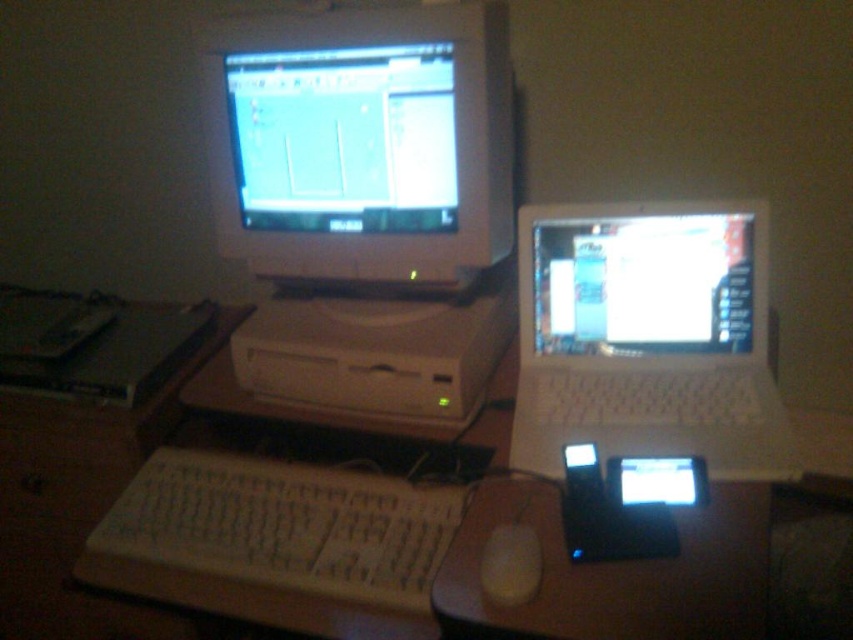
Is white glossy laptop at center thinner than white plastic mouse at center?

No.

Can you confirm if white glossy laptop at center is positioned below white plastic mouse at center?

No, white glossy laptop at center is not below white plastic mouse at center.

You are a GUI agent. You are given a task and a screenshot of the screen. Output one action in this format:
    pyautogui.click(x=<x>, y=<y>)
    Task: Click on the white glossy laptop at center
    This screenshot has height=640, width=853.
    Given the screenshot: What is the action you would take?
    pyautogui.click(x=643, y=284)

Where is `white glossy laptop at center`? white glossy laptop at center is located at coordinates (643, 284).

At what (x,y) coordinates should I click in order to perform the action: click on white plastic keyboard at center. Please return your answer as a coordinate pair (x, y). The image size is (853, 640). Looking at the image, I should click on (277, 544).

Is white plastic keyboard at center wider than white plastic mouse at center?

Correct, the width of white plastic keyboard at center exceeds that of white plastic mouse at center.

Is point (126, 504) farther from viewer compared to point (492, 561)?

Yes, it is.

This screenshot has height=640, width=853. Identify the location of white plastic keyboard at center. (277, 544).

Who is higher up, white plastic computer desk at center or white plastic mouse at center?

white plastic computer desk at center

Between point (679, 532) and point (508, 557), which one is positioned in front?

Point (508, 557)

This screenshot has height=640, width=853. What do you see at coordinates (328, 596) in the screenshot?
I see `white plastic computer desk at center` at bounding box center [328, 596].

Where is `white plastic computer desk at center`? This screenshot has height=640, width=853. white plastic computer desk at center is located at coordinates (328, 596).